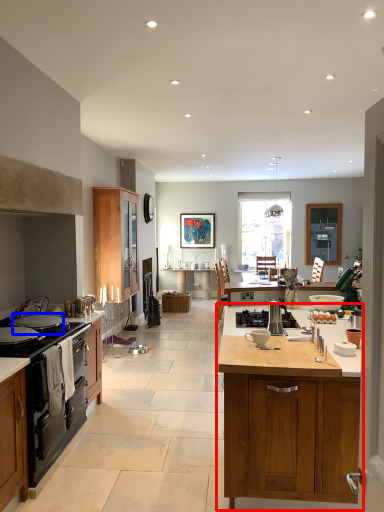
Question: Among these objects, which one is farthest to the camera, cabinetry (highlighted by a red box) or appliance (highlighted by a blue box)?

Choices:
 (A) cabinetry
 (B) appliance

Answer: (B)